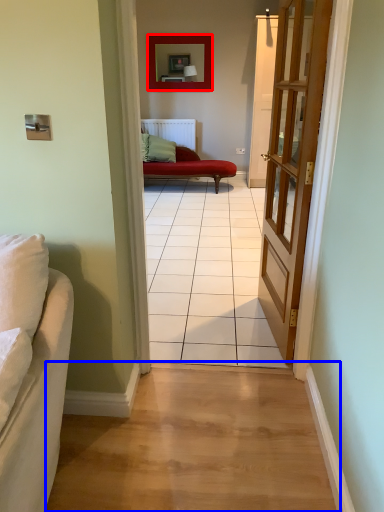
Question: Which of the following is the closest to the observer, picture frame (highlighted by a red box) or path (highlighted by a blue box)?

Choices:
 (A) picture frame
 (B) path

Answer: (B)